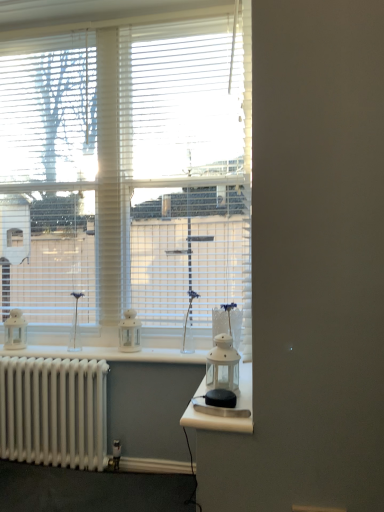
Find the location of a particular element. The image size is (384, 512). white blinds at upper center, which ranks as the 1th window in left-to-right order is located at coordinates (128, 175).

Measure the distance between white glass lantern at center, arranged as the 2th appliance when viewed from the back, and camera.

white glass lantern at center, arranged as the 2th appliance when viewed from the back, is 4.13 feet away from camera.

Describe the element at coordinates (223, 409) in the screenshot. This screenshot has width=384, height=512. I see `white glass lantern at center` at that location.

Where is `white matte window at center, placed as the second window when sorted from left to right`? The image size is (384, 512). white matte window at center, placed as the second window when sorted from left to right is located at coordinates (188, 168).

From a real-world perspective, is white glass lantern at center, the first appliance from the right, positioned above or below white glass lantern at center?

In terms of real-world spatial position, white glass lantern at center, the first appliance from the right, is above white glass lantern at center.

From the image's perspective, would you say white glass lantern at center, arranged as the 2th appliance when viewed from the back, is shown under white glass lantern at center?

No.

Who is taller, white glass lantern at center, the first appliance from the right, or white glass lantern at center?

white glass lantern at center, the first appliance from the right, is taller.

How distant is white glass lantern at center, arranged as the 2th appliance when viewed from the back, from white glass lantern at center?

5.05 inches.

Measure the distance between white glass lantern at center and white matte window at center, placed as the second window when sorted from left to right.

1.10 meters.

Is white glass lantern at center shorter than white matte window at center, placed as the second window when sorted from left to right?

Indeed, white glass lantern at center has a lesser height compared to white matte window at center, placed as the second window when sorted from left to right.

Is white glass lantern at center positioned far away from white matte window at center, placed as the second window when sorted from left to right?

Yes, white glass lantern at center and white matte window at center, placed as the second window when sorted from left to right, are located far from each other.

Does white glass lantern at center lie behind white matte window at center, the first window positioned from the right?

No, it is not.

In the image, is white matte window at center, the first window positioned from the right, positioned in front of or behind white blinds at upper center, marked as the second window in a right-to-left arrangement?

Visually, white matte window at center, the first window positioned from the right, is located behind white blinds at upper center, marked as the second window in a right-to-left arrangement.

From a real-world perspective, is white matte window at center, placed as the second window when sorted from left to right, on white blinds at upper center, which ranks as the 1th window in left-to-right order?

Yes, from a real-world perspective, white matte window at center, placed as the second window when sorted from left to right, is on top of white blinds at upper center, which ranks as the 1th window in left-to-right order.

Find the location of a particular element. radiator lying on the left of white blinds at upper center, which ranks as the 1th window in left-to-right order is located at coordinates (54, 411).

Between white blinds at upper center, which ranks as the 1th window in left-to-right order, and white metallic radiator at lower left, which one has larger size?

Bigger between the two is white blinds at upper center, which ranks as the 1th window in left-to-right order.

Who is taller, white blinds at upper center, which ranks as the 1th window in left-to-right order, or white metallic radiator at lower left?

white blinds at upper center, which ranks as the 1th window in left-to-right order.

Is white metallic radiator at lower left surrounded by white blinds at upper center, which ranks as the 1th window in left-to-right order?

No, white metallic radiator at lower left is not inside white blinds at upper center, which ranks as the 1th window in left-to-right order.

Considering the relative sizes of white blinds at upper center, which ranks as the 1th window in left-to-right order, and white matte window at center, the first window positioned from the right, in the image provided, is white blinds at upper center, which ranks as the 1th window in left-to-right order, wider than white matte window at center, the first window positioned from the right,?

No.

How far apart are white blinds at upper center, which ranks as the 1th window in left-to-right order, and white matte window at center, placed as the second window when sorted from left to right?

white blinds at upper center, which ranks as the 1th window in left-to-right order, is 13.88 centimeters from white matte window at center, placed as the second window when sorted from left to right.

From a real-world perspective, is white blinds at upper center, which ranks as the 1th window in left-to-right order, beneath white matte window at center, the first window positioned from the right?

Indeed, from a real-world perspective, white blinds at upper center, which ranks as the 1th window in left-to-right order, is positioned beneath white matte window at center, the first window positioned from the right.

Is white glass lantern at center wider than white blinds at upper center, which ranks as the 1th window in left-to-right order?

Yes.

From the image's perspective, between white glass lantern at center and white blinds at upper center, which ranks as the 1th window in left-to-right order, who is located below?

white glass lantern at center.

Which is more to the left, white glass lantern at center or white blinds at upper center, marked as the second window in a right-to-left arrangement?

white blinds at upper center, marked as the second window in a right-to-left arrangement, is more to the left.

Can we say white glass lantern at center lies outside white blinds at upper center, which ranks as the 1th window in left-to-right order?

Yes, white glass lantern at center is outside of white blinds at upper center, which ranks as the 1th window in left-to-right order.

From the image's perspective, between white glass lantern at center and white matte lantern at center, arranged as the second appliance when viewed from the right, who is located below?

white glass lantern at center, from the image's perspective.

Are white glass lantern at center and white matte lantern at center, which is the first appliance in left-to-right order, beside each other?

No, white glass lantern at center is not in contact with white matte lantern at center, which is the first appliance in left-to-right order.

From a real-world perspective, which is physically above, white glass lantern at center or white matte lantern at center, which is the first appliance in left-to-right order?

From a 3D spatial view, white matte lantern at center, which is the first appliance in left-to-right order, is above.

From the picture: Who is bigger, white glass lantern at center or white matte lantern at center, the second appliance in the front-to-back sequence?

white glass lantern at center is bigger.

Locate an element on the screen. The width and height of the screenshot is (384, 512). table that is on the right side of white glass lantern at center, which is the second appliance from left to right is located at coordinates (223, 409).

Find the location of `window that is the 2nd object located behind the white glass lantern at center`. window that is the 2nd object located behind the white glass lantern at center is located at coordinates [188, 168].

Considering their positions, is white glass lantern at center, which is the second appliance from left to right, positioned closer to white matte lantern at center, which is the first appliance in left-to-right order, than white glass lantern at center?

The object closer to white matte lantern at center, which is the first appliance in left-to-right order, is white glass lantern at center, which is the second appliance from left to right.

Based on the photo, from the image, which object appears to be nearer to white blinds at upper center, marked as the second window in a right-to-left arrangement, white matte window at center, the first window positioned from the right, or white glass lantern at center, the first appliance from the right?

The object closer to white blinds at upper center, marked as the second window in a right-to-left arrangement, is white matte window at center, the first window positioned from the right.

When comparing their distances from white blinds at upper center, which ranks as the 1th window in left-to-right order, does white glass lantern at center, arranged as the 2th appliance when viewed from the back, or white matte lantern at center, arranged as the second appliance when viewed from the right, seem further?

Based on the image, white glass lantern at center, arranged as the 2th appliance when viewed from the back, appears to be further to white blinds at upper center, which ranks as the 1th window in left-to-right order.

From the picture: Looking at the image, which one is located further to white glass lantern at center, white matte lantern at center, arranged as the second appliance when viewed from the right, or white plastic blinds at upper left?

Among the two, white plastic blinds at upper left is located further to white glass lantern at center.

From the image, which object appears to be nearer to white matte lantern at center, the second appliance in the front-to-back sequence, white glass lantern at center, the first appliance from the right, or white plastic blinds at upper left?

white glass lantern at center, the first appliance from the right, is closer to white matte lantern at center, the second appliance in the front-to-back sequence.

Based on their spatial positions, is white glass lantern at center, arranged as the 2th appliance when viewed from the back, or white plastic blinds at upper left further from white blinds at upper center, which ranks as the 1th window in left-to-right order?

white glass lantern at center, arranged as the 2th appliance when viewed from the back, lies further to white blinds at upper center, which ranks as the 1th window in left-to-right order, than the other object.

When comparing their distances from white matte window at center, placed as the second window when sorted from left to right, does white glass lantern at center, which is the second appliance from left to right, or white blinds at upper center, which ranks as the 1th window in left-to-right order, seem closer?

white blinds at upper center, which ranks as the 1th window in left-to-right order, lies closer to white matte window at center, placed as the second window when sorted from left to right, than the other object.

Estimate the real-world distances between objects in this image. Which object is further from white plastic blinds at upper left, white blinds at upper center, which ranks as the 1th window in left-to-right order, or white matte lantern at center, arranged as the second appliance when viewed from the right?

white matte lantern at center, arranged as the second appliance when viewed from the right, is positioned further to the anchor white plastic blinds at upper left.

The height and width of the screenshot is (512, 384). I want to click on appliance between white metallic radiator at lower left and white glass lantern at center, the 1th appliance when ordered from front to back, in the horizontal direction, so click(x=129, y=332).

This screenshot has width=384, height=512. What are the coordinates of `appliance between white plastic blinds at upper left and white glass lantern at center, the first appliance from the right` in the screenshot? It's located at coord(129,332).

You are a GUI agent. You are given a task and a screenshot of the screen. Output one action in this format:
    pyautogui.click(x=<x>, y=<y>)
    Task: Click on the appliance between white blinds at upper center, which ranks as the 1th window in left-to-right order, and white matte lantern at center, arranged as the second appliance when viewed from the right, in the vertical direction
    
    Given the screenshot: What is the action you would take?
    pyautogui.click(x=222, y=366)

This screenshot has height=512, width=384. Find the location of `table between white plastic blinds at upper left and white metallic radiator at lower left in the up-down direction`. table between white plastic blinds at upper left and white metallic radiator at lower left in the up-down direction is located at coordinates (223, 409).